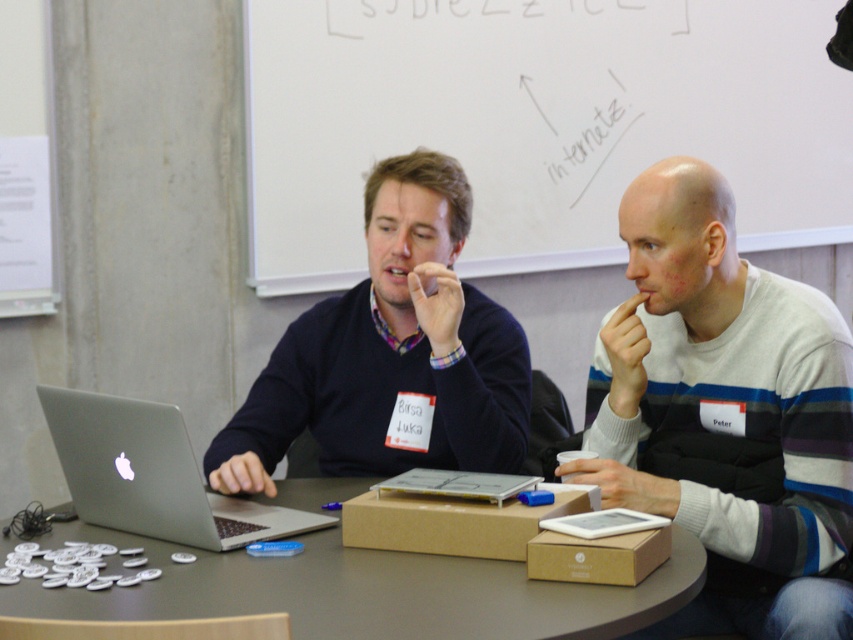
Measure the distance from whiteboard at upper center to silver metallic laptop at center.

The distance of whiteboard at upper center from silver metallic laptop at center is 1.53 meters.

Which is in front, point (485, 134) or point (199, 513)?

Point (199, 513) is in front.

I want to click on whiteboard at upper center, so click(x=537, y=122).

Between whiteboard at upper center and matte brown cardboard box at center, which one is positioned lower?

Positioned lower is matte brown cardboard box at center.

Does whiteboard at upper center have a greater width compared to matte brown cardboard box at center?

Indeed, whiteboard at upper center has a greater width compared to matte brown cardboard box at center.

Who is more forward, (248, 179) or (207, 556)?

Positioned in front is point (207, 556).

The image size is (853, 640). In order to click on whiteboard at upper center in this screenshot , I will do `click(537, 122)`.

Based on the photo, who is lower down, silver metallic laptop at center or brown cardboard box at center?

brown cardboard box at center is lower down.

Is silver metallic laptop at center to the left of brown cardboard box at center from the viewer's perspective?

Indeed, silver metallic laptop at center is positioned on the left side of brown cardboard box at center.

Where is `silver metallic laptop at center`? silver metallic laptop at center is located at coordinates (152, 476).

Where is `silver metallic laptop at center`? silver metallic laptop at center is located at coordinates (152, 476).